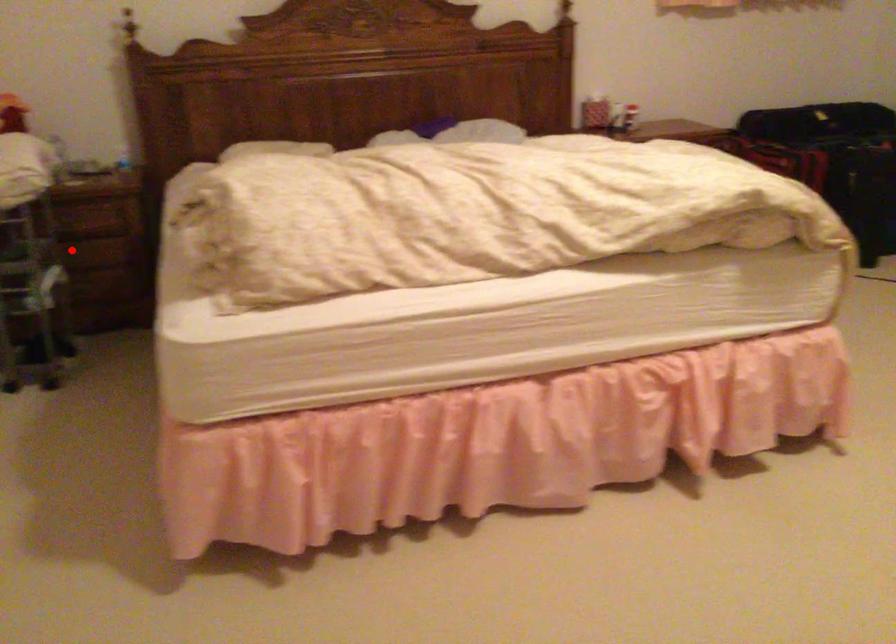
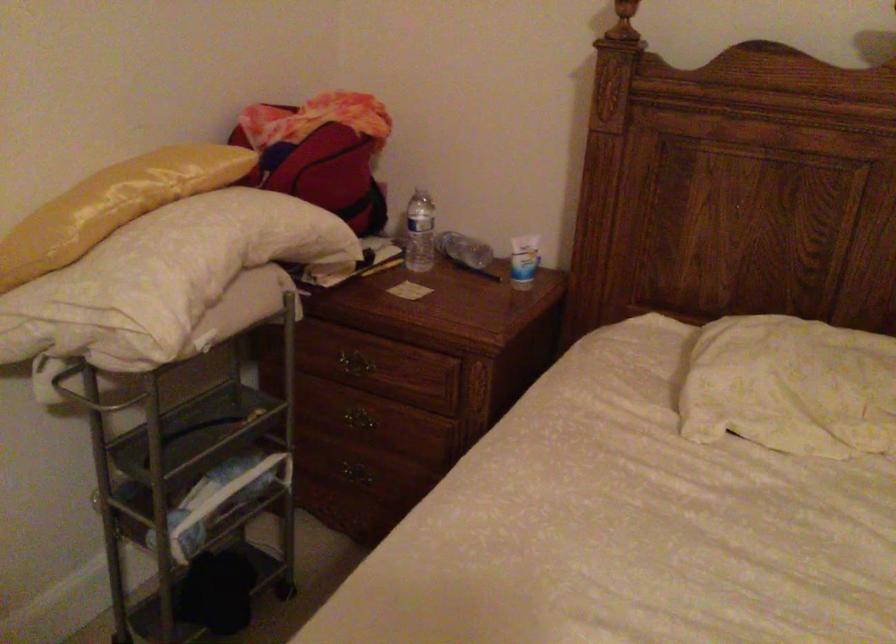
Find the pixel in the second image that matches the highlighted location in the first image.

(357, 426)